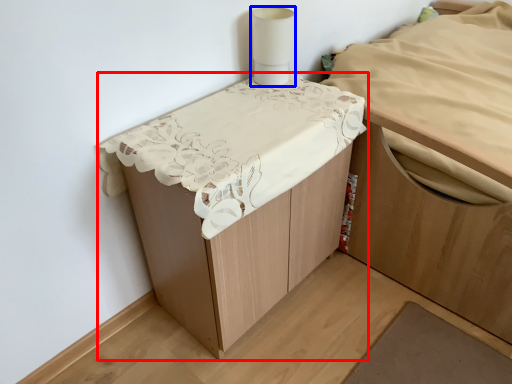
Question: Which point is closer to the camera, furniture (highlighted by a red box) or lamp (highlighted by a blue box)?

Choices:
 (A) furniture
 (B) lamp

Answer: (A)